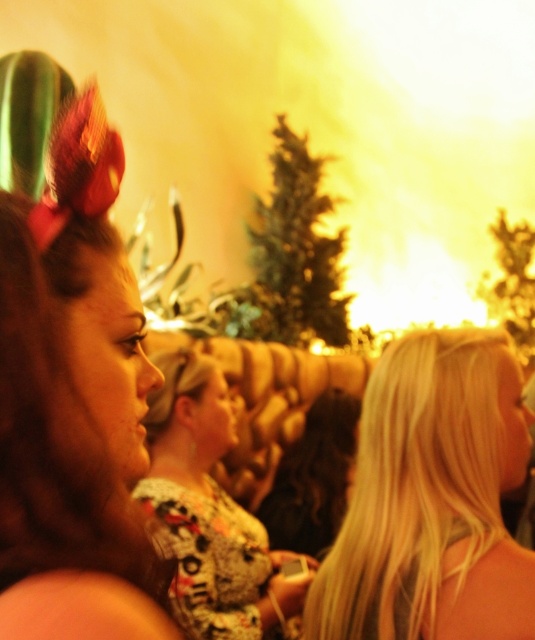
You are standing in the crowd at the event and want to locate the point marked at coordinates (68, 444). According to the scene description, where exactly would this point be located?

The point marked at coordinates (68, 444) is located on the brown shiny hair at left.